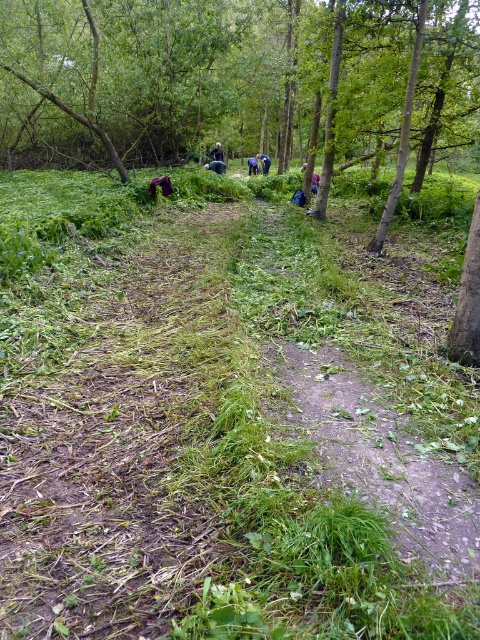
Which of these two, green leafy tree at center or blue denim jacket at center, stands taller?

green leafy tree at center is taller.

Is green leafy tree at center positioned behind blue denim jacket at center?

No, it is not.

Which is in front, point (62, 154) or point (264, 154)?

Positioned in front is point (62, 154).

This screenshot has width=480, height=640. Identify the location of green leafy tree at center. (235, 81).

Can you confirm if green leafy tree at center is positioned to the right of dirt path at center?

No, green leafy tree at center is not to the right of dirt path at center.

Can you confirm if green leafy tree at center is positioned above dirt path at center?

Correct, green leafy tree at center is located above dirt path at center.

Does point (308, 22) come in front of point (348, 468)?

No, (308, 22) is behind (348, 468).

Locate an element on the screen. green leafy tree at center is located at coordinates (235, 81).

Image resolution: width=480 pixels, height=640 pixels. In order to click on green leafy grass at center in this screenshot , I will do [222, 426].

Is point (175, 243) positioned behind point (217, 145)?

No, (175, 243) is in front of (217, 145).

Identify the location of green leafy grass at center. (222, 426).